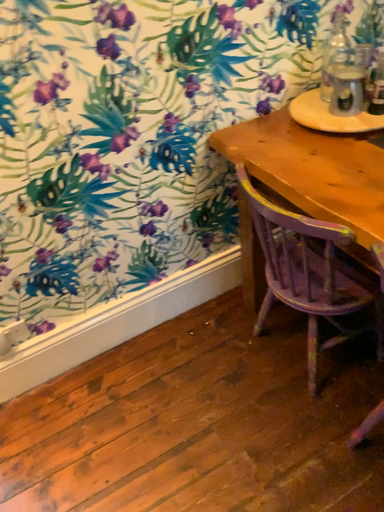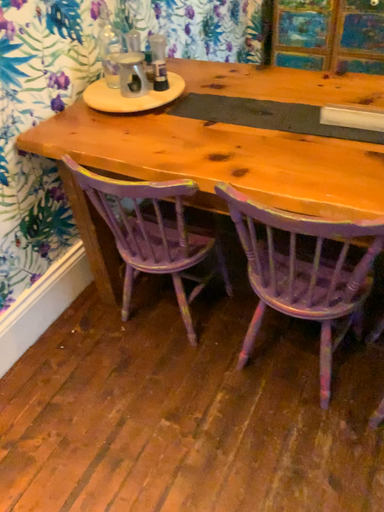
Question: How did the camera likely rotate when shooting the video?

Choices:
 (A) rotated upward
 (B) rotated downward

Answer: (A)